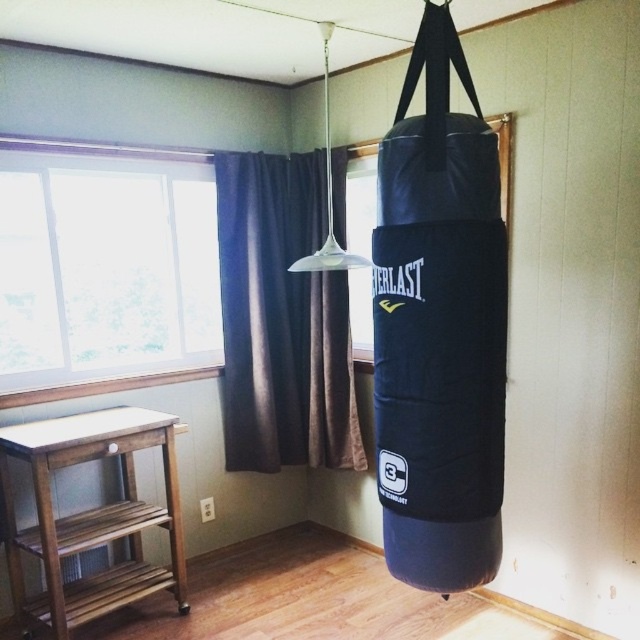
Between point (60, 324) and point (308, 371), which one is positioned in front?

Point (60, 324) is in front.

Is point (80, 144) closer to camera compared to point (252, 452)?

That is True.

Locate an element on the screen. This screenshot has width=640, height=640. transparent glass window at upper left is located at coordinates (104, 262).

Is point (256, 387) farther from camera compared to point (352, 218)?

No.

Which is above, dark velvet curtain at center or transparent glass window at center?

transparent glass window at center is higher up.

Between point (248, 262) and point (355, 284), which one is positioned in front?

Point (248, 262)

Locate an element on the screen. dark velvet curtain at center is located at coordinates (282, 320).

Can you confirm if transparent glass window at upper left is smaller than transparent glass window at center?

No, transparent glass window at upper left is not smaller than transparent glass window at center.

Does transparent glass window at upper left have a lesser width compared to transparent glass window at center?

Incorrect, transparent glass window at upper left's width is not less than transparent glass window at center's.

Is point (76, 221) less distant than point (358, 292)?

Yes, it is.

Find the location of a particular element. The height and width of the screenshot is (640, 640). transparent glass window at upper left is located at coordinates (104, 262).